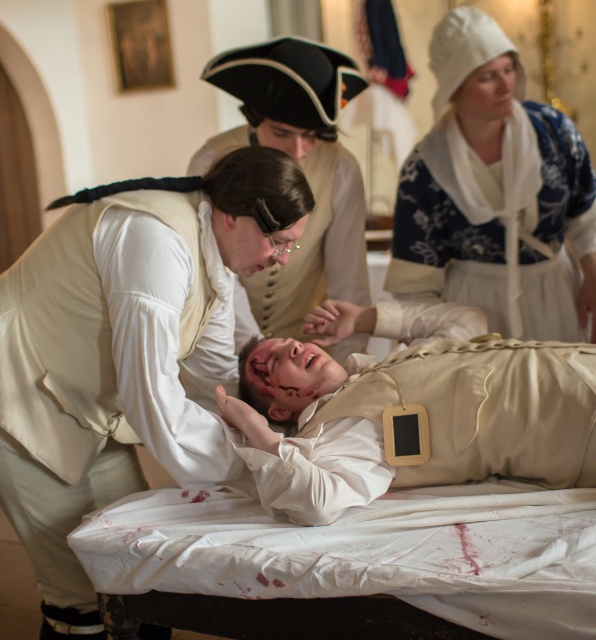
Question: Which object is farther from the camera taking this photo?

Choices:
 (A) matte white shirt at center
 (B) white floral dress at upper right

Answer: (B)

Question: Which object is positioned closest to the white floral dress at upper right?

Choices:
 (A) matte black hat at center
 (B) matte white shirt at center
 (C) beige fabric baby at center

Answer: (A)

Question: Is matte white shirt at center below beige fabric baby at center?

Choices:
 (A) no
 (B) yes

Answer: (A)

Question: Does matte white shirt at center appear under white floral dress at upper right?

Choices:
 (A) yes
 (B) no

Answer: (A)

Question: Can you confirm if matte white shirt at center is smaller than beige fabric baby at center?

Choices:
 (A) no
 (B) yes

Answer: (A)

Question: Which of these objects is positioned farthest from the matte white shirt at center?

Choices:
 (A) beige fabric baby at center
 (B) matte black hat at center
 (C) white floral dress at upper right

Answer: (C)